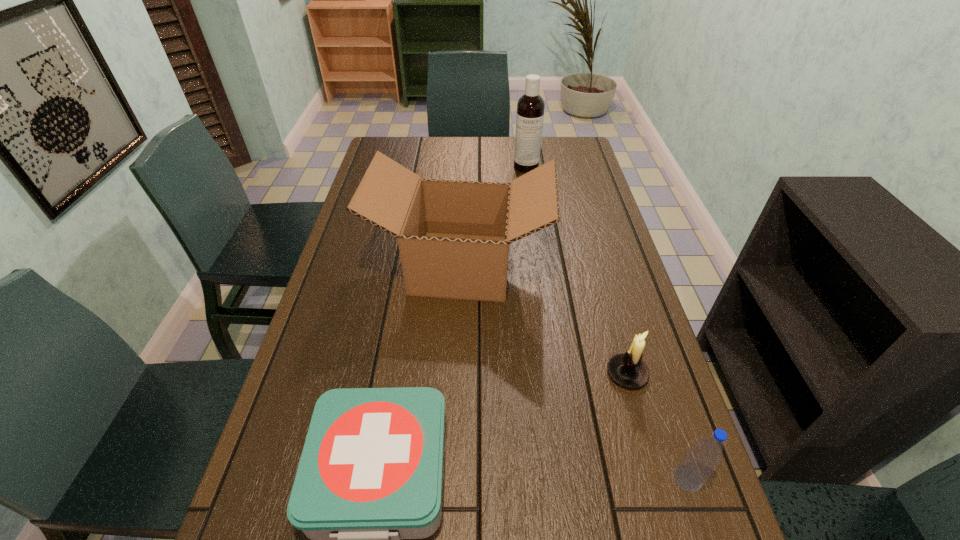
Find the location of a particular element. The image size is (960, 540). the tallest object is located at coordinates (530, 108).

This screenshot has height=540, width=960. In order to click on dishwasher detergent in this screenshot , I will do `click(530, 108)`.

Identify the location of the fourth shortest object. click(x=453, y=236).

You are a GUI agent. You are given a task and a screenshot of the screen. Output one action in this format:
    pyautogui.click(x=<x>, y=<y>)
    Task: Click on the second farthest object
    
    Given the screenshot: What is the action you would take?
    pyautogui.click(x=453, y=236)

At what (x,y) coordinates should I click in order to perform the action: click on water bottle. Please return your answer as a coordinate pair (x, y). Looking at the image, I should click on (698, 464).

Locate an element on the screen. The image size is (960, 540). the third farthest object is located at coordinates (627, 369).

I want to click on candle holder, so click(x=627, y=369).

Where is `vacant region located on the label side of the dishwasher detergent`? vacant region located on the label side of the dishwasher detergent is located at coordinates (533, 216).

Where is `free region located on the back of the box`? The width and height of the screenshot is (960, 540). free region located on the back of the box is located at coordinates (465, 202).

Find the location of a particular element. free location located 0.310m on the left of the water bottle is located at coordinates (515, 478).